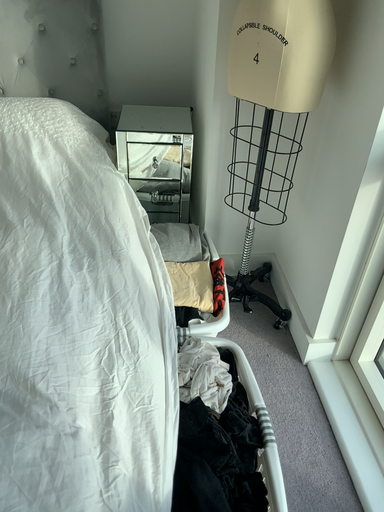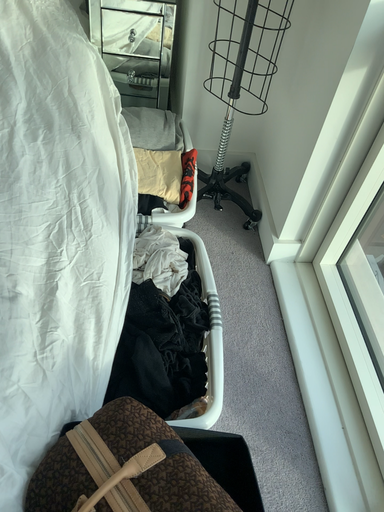
Question: Which way did the camera rotate in the video?

Choices:
 (A) rotated upward
 (B) rotated downward

Answer: (B)